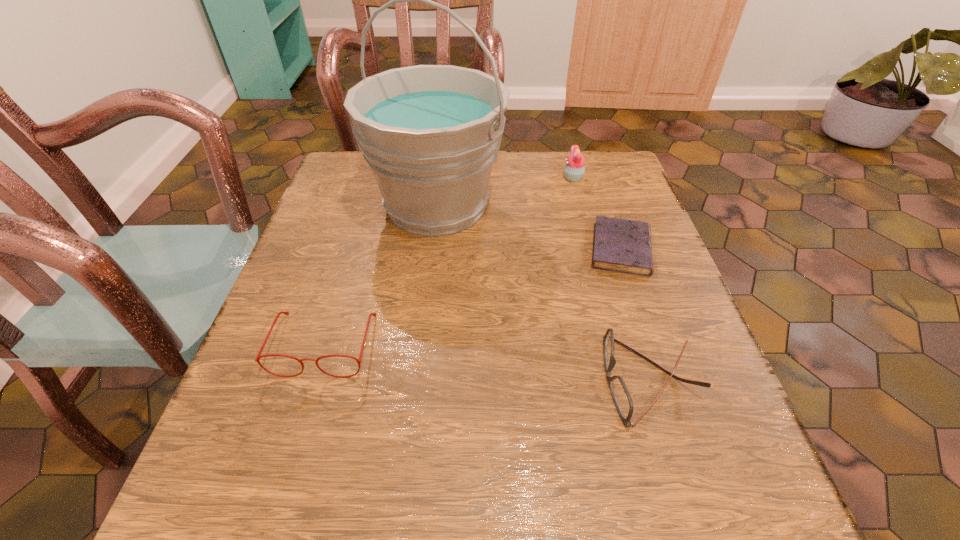
Locate an element on the screen. This screenshot has width=960, height=540. vacant space in between the cupcake and the bucket is located at coordinates (505, 192).

At what (x,y) coordinates should I click in order to perform the action: click on free space between the cupcake and the right spectacles. Please return your answer as a coordinate pair (x, y). The image size is (960, 540). Looking at the image, I should click on (612, 279).

Select which object appears as the second closest to the shorter spectacles. Please provide its 2D coordinates. Your answer should be formatted as a tuple, i.e. [(x, y)], where the tuple contains the x and y coordinates of a point satisfying the conditions above.

[(430, 134)]

Point out which object is positioned as the fourth nearest to the bucket. Please provide its 2D coordinates. Your answer should be formatted as a tuple, i.e. [(x, y)], where the tuple contains the x and y coordinates of a point satisfying the conditions above.

[(620, 393)]

I want to click on free spot that satisfies the following two spatial constraints: 1. on the face of the second tallest object; 2. on the face of the left spectacles, so click(618, 344).

Locate an element on the screen. The height and width of the screenshot is (540, 960). vacant region that satisfies the following two spatial constraints: 1. on the face of the fourth shortest object; 2. on the right side of the shortest object is located at coordinates (592, 249).